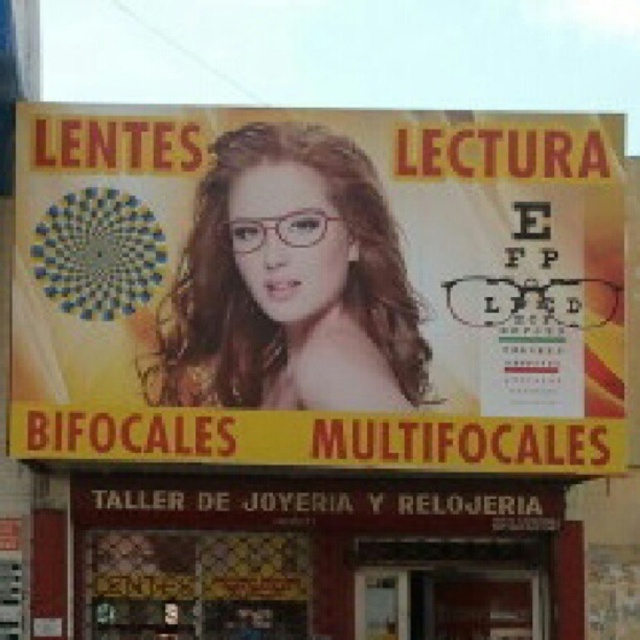
Question: Which point is closer to the camera taking this photo?

Choices:
 (A) (525, 316)
 (B) (208, 268)
 (C) (138, 500)

Answer: (B)

Question: Which point appears farthest from the camera in this image?

Choices:
 (A) (184, 250)
 (B) (429, 598)

Answer: (B)

Question: Is matte plastic glasses at upper center to the right of brown wood sign at lower center from the viewer's perspective?

Choices:
 (A) no
 (B) yes

Answer: (A)

Question: Is matte plastic glasses at upper center below brown wood sign at lower center?

Choices:
 (A) no
 (B) yes

Answer: (A)

Question: Which object appears farthest from the camera in this image?

Choices:
 (A) matte pink glasses at center
 (B) brown wood sign at lower center

Answer: (B)

Question: Does brown wood sign at lower center have a lesser width compared to matte pink glasses at center?

Choices:
 (A) yes
 (B) no

Answer: (B)